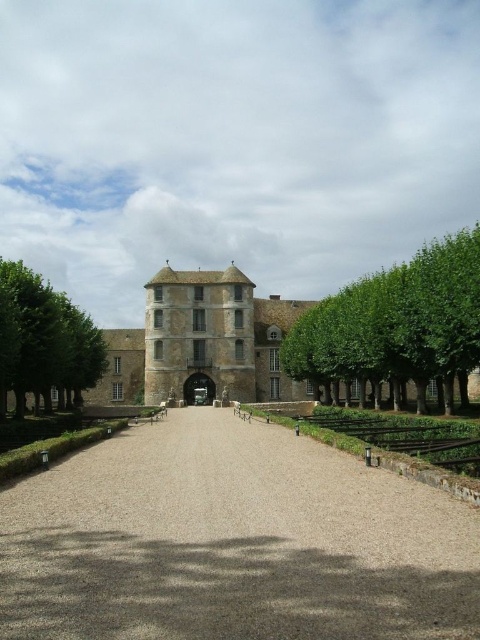
Is green leafy tree at center closer to the viewer compared to green leafy tree at left?

Yes, green leafy tree at center is closer to the viewer.

Can you confirm if green leafy tree at center is taller than green leafy tree at left?

Yes, green leafy tree at center is taller than green leafy tree at left.

Who is more distant from viewer, (391, 328) or (0, 266)?

The point (0, 266) is more distant.

I want to click on green leafy tree at center, so click(396, 321).

Can you confirm if gray gravel driveway at center is positioned to the left of green leafy tree at left?

No, gray gravel driveway at center is not to the left of green leafy tree at left.

Between gray gravel driveway at center and green leafy tree at left, which one appears on the left side from the viewer's perspective?

From the viewer's perspective, green leafy tree at left appears more on the left side.

Where is `gray gravel driveway at center`? gray gravel driveway at center is located at coordinates (232, 541).

I want to click on gray gravel driveway at center, so click(232, 541).

From the picture: Is gray gravel driveway at center to the left of green leafy tree at center from the viewer's perspective?

Correct, you'll find gray gravel driveway at center to the left of green leafy tree at center.

Does gray gravel driveway at center appear over green leafy tree at center?

No, gray gravel driveway at center is not above green leafy tree at center.

The width and height of the screenshot is (480, 640). I want to click on gray gravel driveway at center, so click(232, 541).